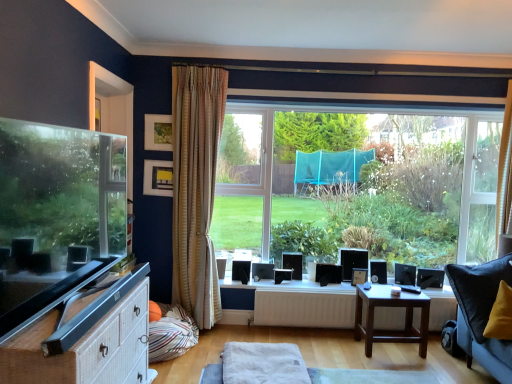
Where is `free space that is in between brown wooden table at lower right and white matte radiator at center`? Image resolution: width=512 pixels, height=384 pixels. free space that is in between brown wooden table at lower right and white matte radiator at center is located at coordinates (317, 339).